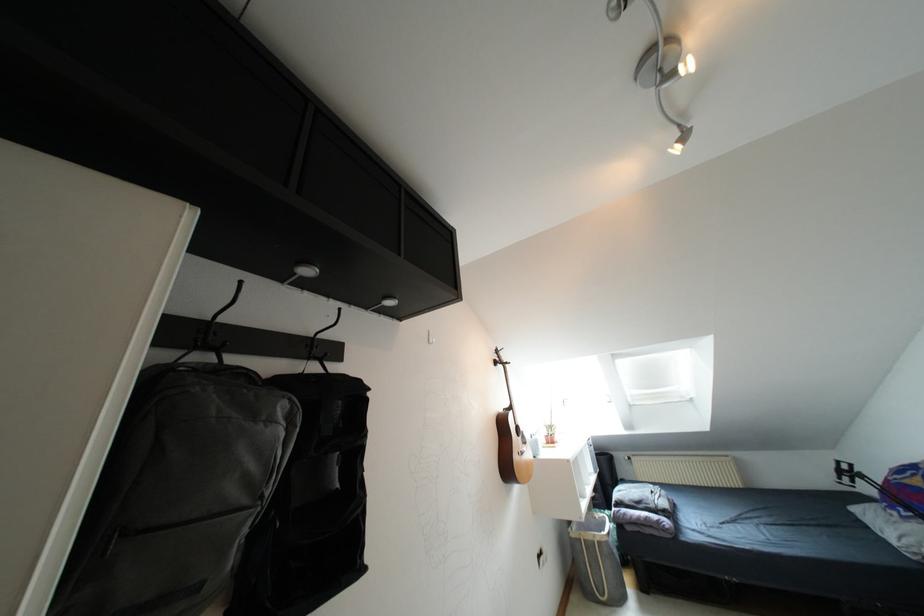
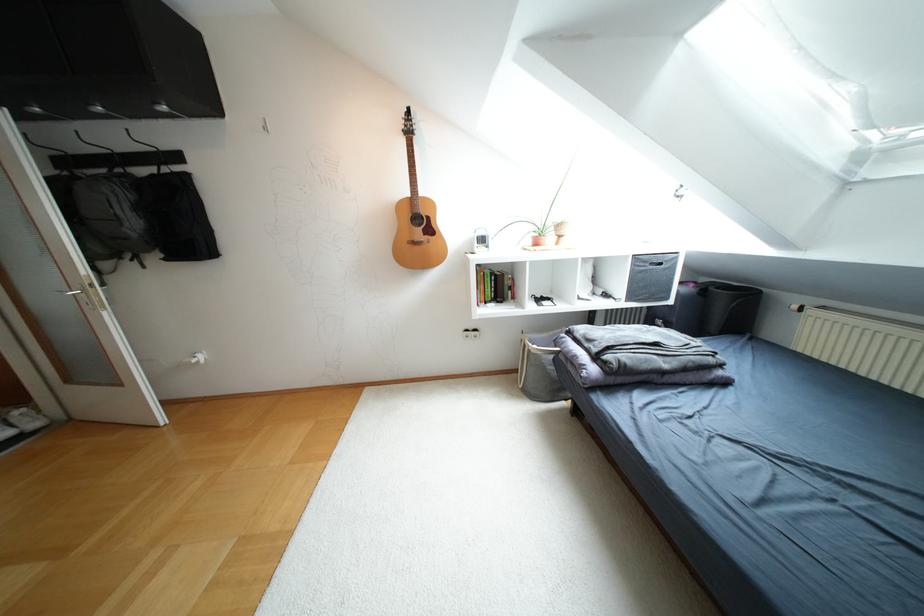
In the second image, find the point that corresponds to point 646,517 in the first image.

(575, 357)